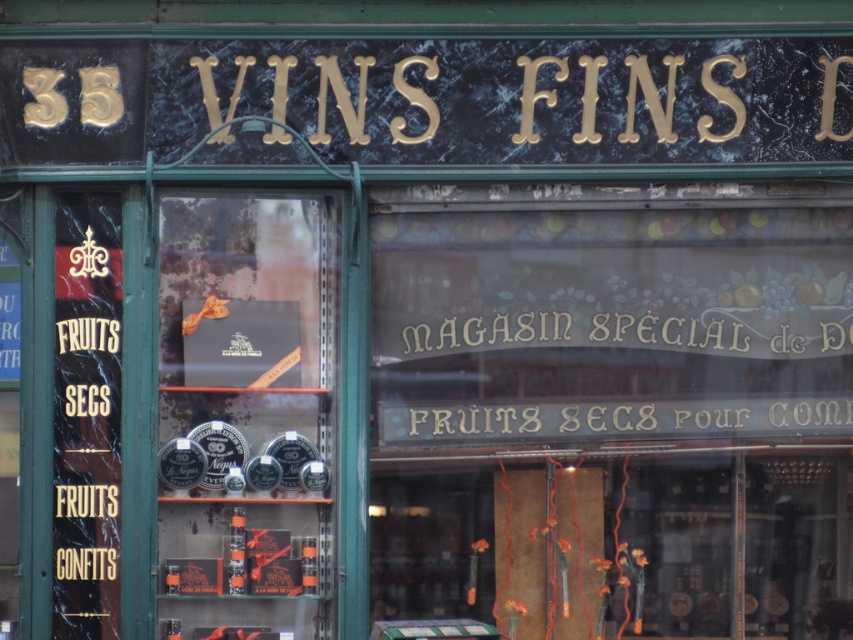
Between transparent glass signboard at center and white metallic sign at center, which one is positioned lower?

transparent glass signboard at center is below.

Is transparent glass signboard at center shorter than white metallic sign at center?

In fact, transparent glass signboard at center may be taller than white metallic sign at center.

The height and width of the screenshot is (640, 853). In order to click on transparent glass signboard at center in this screenshot , I will do `click(613, 410)`.

Can you confirm if matte black box at center is positioned to the left of white metallic sign at center?

Correct, you'll find matte black box at center to the left of white metallic sign at center.

Between point (233, 442) and point (799, 348), which one is positioned behind?

The point (799, 348) is more distant.

Where is `matte black box at center`? This screenshot has width=853, height=640. matte black box at center is located at coordinates (247, 416).

Is transparent glass signboard at center shorter than matte black box at center?

In fact, transparent glass signboard at center may be taller than matte black box at center.

Is transparent glass signboard at center above matte black box at center?

Actually, transparent glass signboard at center is below matte black box at center.

Does point (659, 259) come farther from viewer compared to point (323, 616)?

Yes, point (659, 259) is behind point (323, 616).

This screenshot has width=853, height=640. In order to click on transparent glass signboard at center in this screenshot , I will do `click(613, 410)`.